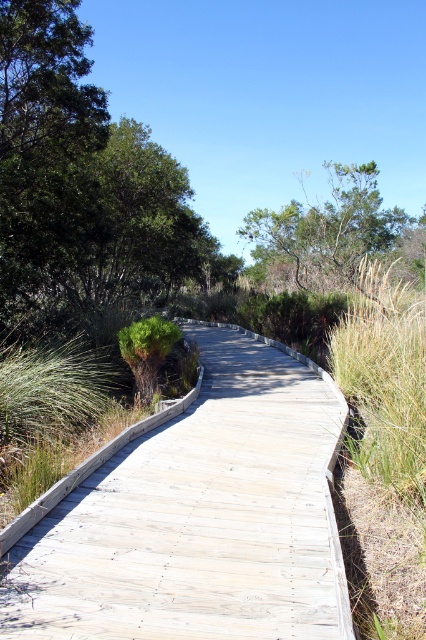
You are standing on the wooden boardwalk and want to walk to the point at coordinates point [238,368]. If your walking path is 10 meters long, will you reach the point before the path curves to the left?

The distance between you and the point [238,368] is 11.81 meters. Since your walking path is only 10 meters long, you will not reach the point before the path curves to the left.

You are standing at the starting point of the boardwalk and want to reach the light gray wooden boardwalk at center. Which direction should you walk to get there?

You should walk forward along the boardwalk since the light gray wooden boardwalk at center is located straight ahead at point (199, 516).

You are standing on the boardwalk and looking towards the distant curve. You notice two points marked on the boardwalk. Which point, point [227,273] or point [420,224], is closer to you?

Point [227,273] is closer to the viewer than point [420,224].